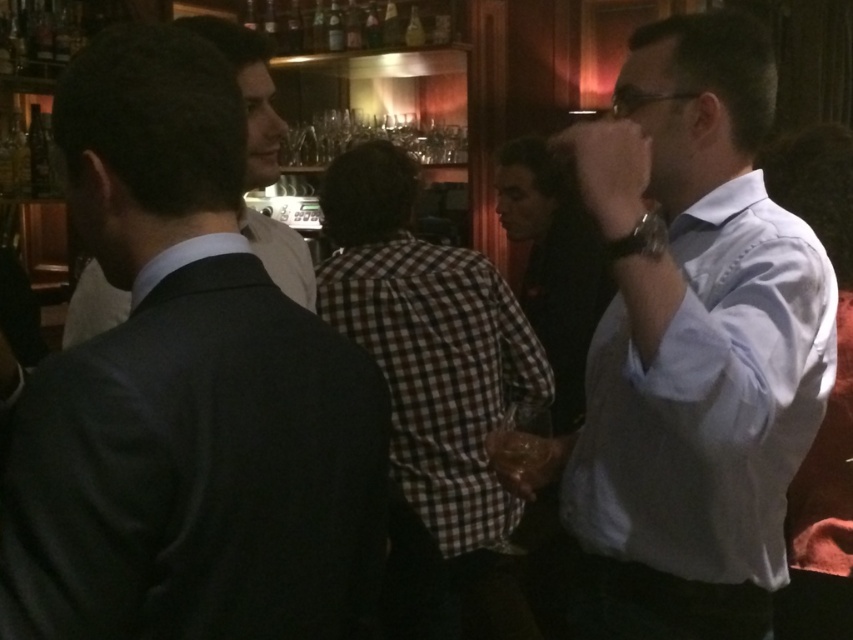
Between checkered fabric shirt at center and dark suit jacket at center, which one is positioned lower?

Positioned lower is checkered fabric shirt at center.

Based on the photo, is checkered fabric shirt at center below dark suit jacket at center?

Indeed, checkered fabric shirt at center is positioned under dark suit jacket at center.

Where is `checkered fabric shirt at center`? checkered fabric shirt at center is located at coordinates (434, 371).

Where is `checkered fabric shirt at center`? checkered fabric shirt at center is located at coordinates (434, 371).

Does checkered shirt at center have a smaller size compared to dark suit jacket at center?

No.

Is point (544, 340) positioned before point (82, 324)?

That is False.

Is point (544, 355) farther from camera compared to point (263, 100)?

Yes, point (544, 355) is farther from viewer.

This screenshot has width=853, height=640. I want to click on checkered shirt at center, so click(x=554, y=264).

Is checkered shirt at center further to camera compared to glass bottles at upper center?

No, it is not.

Identify the location of checkered shirt at center. (554, 264).